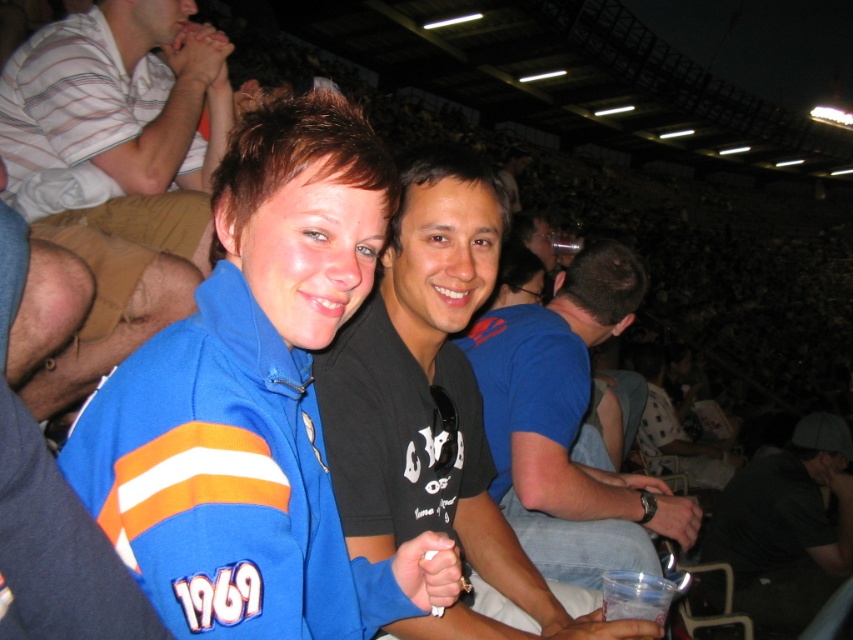
How much distance is there between striped cotton shirt at upper left and black cotton t-shirt at center?

A distance of 1.48 meters exists between striped cotton shirt at upper left and black cotton t-shirt at center.

Does striped cotton shirt at upper left appear over black cotton t-shirt at center?

Correct, striped cotton shirt at upper left is located above black cotton t-shirt at center.

What do you see at coordinates (119, 168) in the screenshot? Image resolution: width=853 pixels, height=640 pixels. I see `striped cotton shirt at upper left` at bounding box center [119, 168].

Where is `striped cotton shirt at upper left`? striped cotton shirt at upper left is located at coordinates (119, 168).

Is blue fleece jacket at center thinner than black matte shirt at center?

Yes, blue fleece jacket at center is thinner than black matte shirt at center.

Between point (242, 525) and point (408, 636), which one is positioned in front?

Point (242, 525) is in front.

In order to click on blue fleece jacket at center in this screenshot , I will do `click(224, 481)`.

Between blue fleece jacket at center and dark gray t-shirt at center, which one has less height?

blue fleece jacket at center is shorter.

Who is more forward, (160, 518) or (764, 600)?

Point (160, 518)

This screenshot has width=853, height=640. What do you see at coordinates (224, 481) in the screenshot? I see `blue fleece jacket at center` at bounding box center [224, 481].

Where is `blue fleece jacket at center`? blue fleece jacket at center is located at coordinates (224, 481).